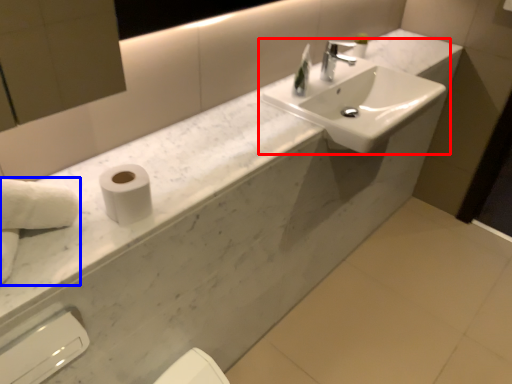
Question: Which of the following is the farthest to the observer, sink (highlighted by a red box) or hand towel (highlighted by a blue box)?

Choices:
 (A) sink
 (B) hand towel

Answer: (A)